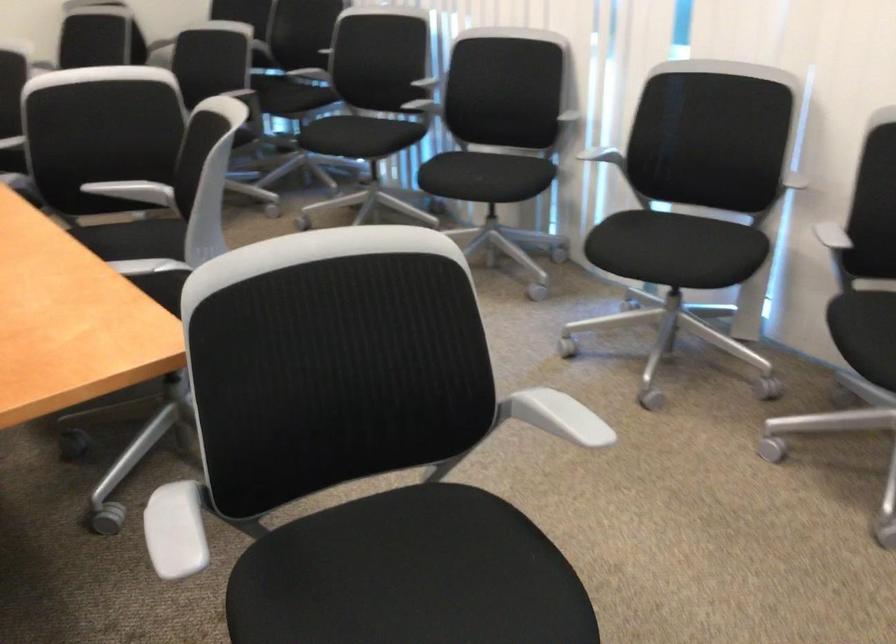
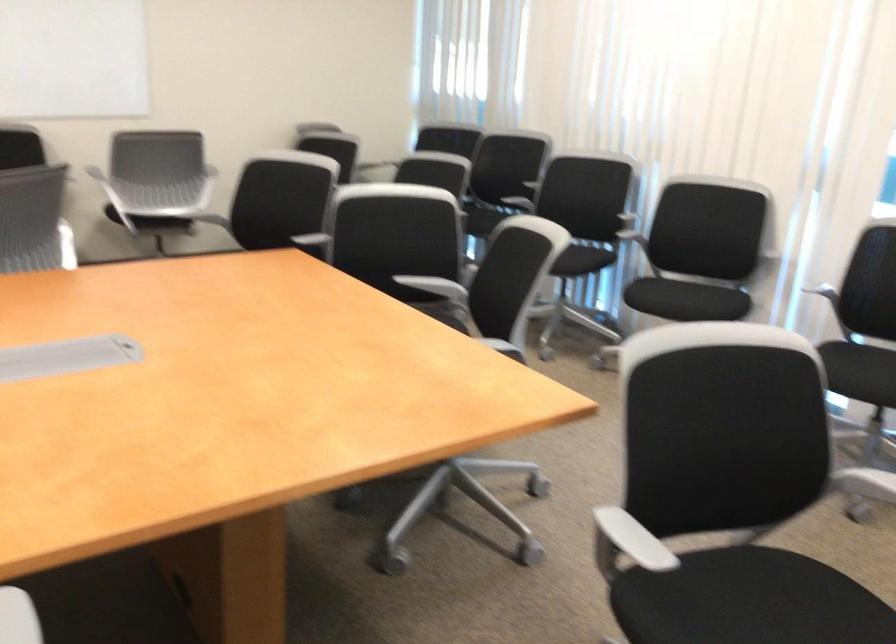
Question: The images are taken continuously from a first-person perspective. In which direction is your viewpoint rotating?

Choices:
 (A) Left
 (B) Right
 (C) Up
 (D) Down

Answer: (C)